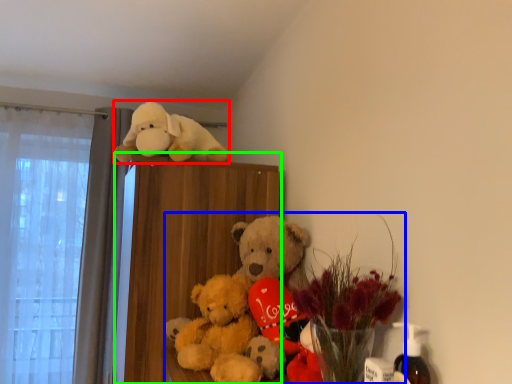
Question: Which is farther away from toy (highlighted by a red box)? floral arrangement (highlighted by a blue box) or bookshelf (highlighted by a green box)?

Choices:
 (A) floral arrangement
 (B) bookshelf

Answer: (A)